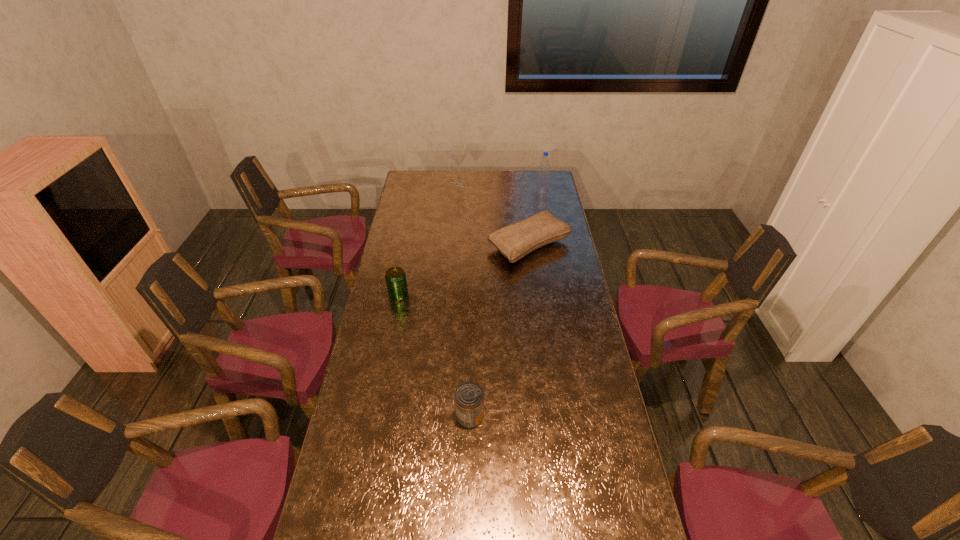
Locate an element on the screen. The height and width of the screenshot is (540, 960). free point located on the front of the nearest object is located at coordinates (468, 516).

This screenshot has width=960, height=540. What are the coordinates of `water bottle at the far edge` in the screenshot? It's located at (542, 185).

This screenshot has width=960, height=540. I want to click on flute glass that is at the far edge, so click(458, 153).

Where is `object located in the left edge section of the desktop`? This screenshot has height=540, width=960. object located in the left edge section of the desktop is located at coordinates (395, 277).

Locate an element on the screen. The height and width of the screenshot is (540, 960). water bottle situated at the right edge is located at coordinates (542, 185).

Find the location of a particular element. cushion located in the right edge section of the desktop is located at coordinates (515, 241).

Find the location of a particular element. The height and width of the screenshot is (540, 960). object that is at the far right corner is located at coordinates (542, 185).

In order to click on vacant area at the far edge in this screenshot , I will do `click(511, 191)`.

The image size is (960, 540). Find the location of `vacant space at the left edge of the desktop`. vacant space at the left edge of the desktop is located at coordinates (370, 417).

The height and width of the screenshot is (540, 960). I want to click on blank space at the right edge of the desktop, so click(571, 282).